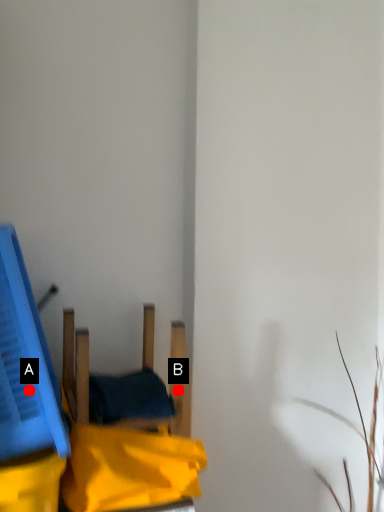
Question: Two points are circled on the image, labeled by A and B beside each circle. Which point appears farthest from the camera in this image?

Choices:
 (A) A is further
 (B) B is further

Answer: (B)